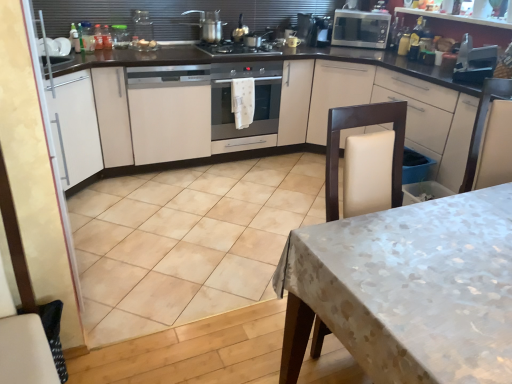
Question: From a real-world perspective, is white matte cabinet at upper right, which is counted as the first cabinetry, starting from the right, above or below satin silver oven at center?

Choices:
 (A) below
 (B) above

Answer: (A)

Question: Is point (367, 99) positioned closer to the camera than point (252, 124)?

Choices:
 (A) farther
 (B) closer

Answer: (B)

Question: Which of these objects is positioned closest to the metallic silver pot at upper center, the first kitchen appliance from the front?

Choices:
 (A) silver metallic microwave at upper right, placed as the first kitchen appliance when sorted from back to front
 (B) metallic silver toaster at upper right, placed as the first appliance when sorted from right to left
 (C) white matte cabinet at center, the 2th cabinetry in the right-to-left sequence
 (D) white matte cabinet at upper right, which is counted as the first cabinetry, starting from the right
 (E) satin silver oven at center

Answer: (E)

Question: Based on their relative distances, which object is nearer to the silver metallic microwave at upper right, the 2th kitchen appliance viewed from the front?

Choices:
 (A) metallic silver toaster at upper right, the second appliance from the top
 (B) metallic silver pot at upper center, the first kitchen appliance from the front
 (C) satin silver oven at center
 (D) white matte cabinet at left, the third cabinetry viewed from the right
 (E) white matte cabinet at upper right, which is counted as the first cabinetry, starting from the right

Answer: (E)